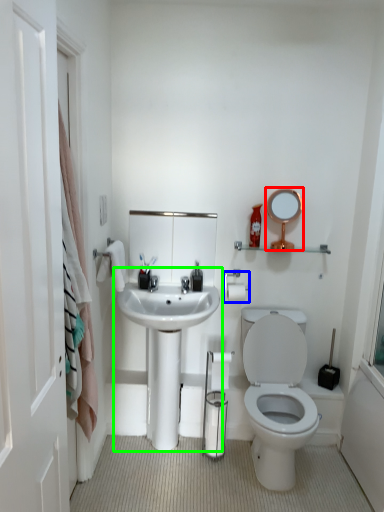
Question: Which object is the closest to the mirror (highlighted by a red box)? Choose among these: towel bar (highlighted by a blue box) or sink (highlighted by a green box).

Choices:
 (A) towel bar
 (B) sink

Answer: (A)